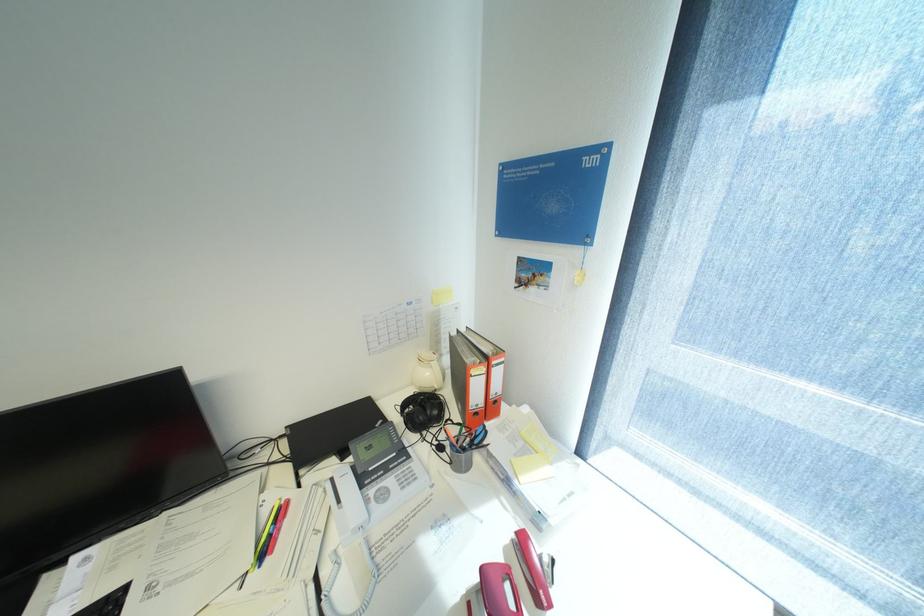
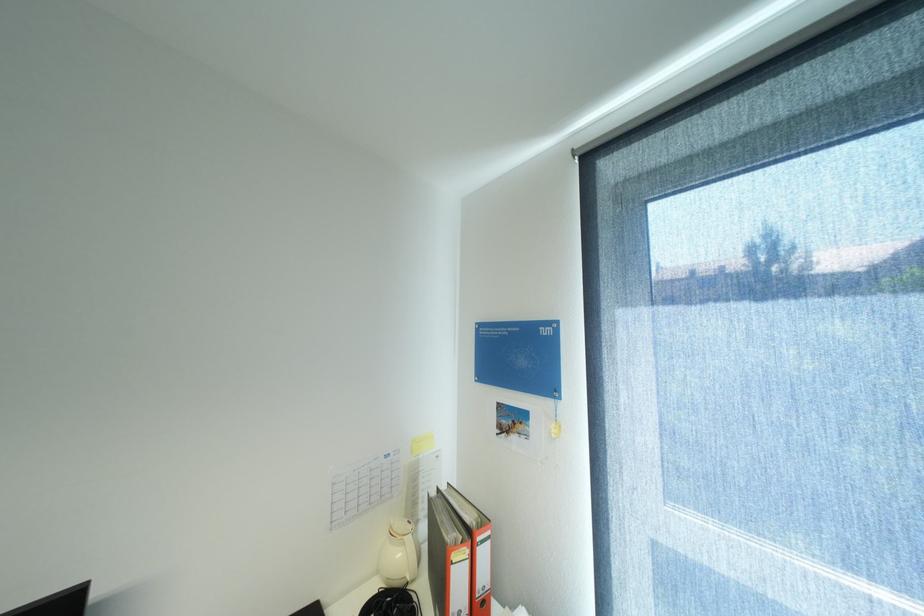
In the second image, find the point that corresponds to (x=436, y=374) in the first image.

(407, 554)